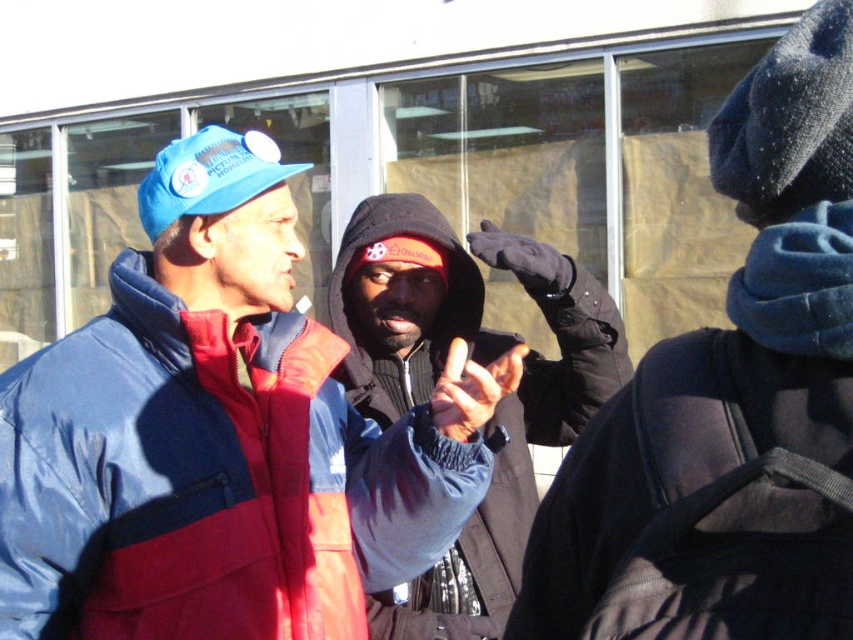
Can you confirm if blue fleece jacket at center is positioned below matte blue cap at upper left?

Indeed, blue fleece jacket at center is positioned under matte blue cap at upper left.

Between blue fleece jacket at center and matte blue cap at upper left, which one appears on the right side from the viewer's perspective?

→ Positioned to the right is blue fleece jacket at center.

Is point (39, 550) positioned after point (210, 180)?

No, it is in front of (210, 180).

You are a GUI agent. You are given a task and a screenshot of the screen. Output one action in this format:
    pyautogui.click(x=<x>, y=<y>)
    Task: Click on the blue fleece jacket at center
    The height and width of the screenshot is (640, 853).
    Given the screenshot: What is the action you would take?
    pyautogui.click(x=219, y=436)

Does black synthetic jacket at lower right appear over matte blue cap at upper left?

No.

Who is taller, black synthetic jacket at lower right or matte blue cap at upper left?

Standing taller between the two is black synthetic jacket at lower right.

Locate an element on the screen. black synthetic jacket at lower right is located at coordinates (701, 502).

Who is more forward, (186, 257) or (616, 467)?

Positioned in front is point (616, 467).

Does blue fleece jacket at center come behind dark blue jacket at center?

That is True.

At what (x,y) coordinates should I click in order to perform the action: click on blue fleece jacket at center. Please return your answer as a coordinate pair (x, y). The height and width of the screenshot is (640, 853). Looking at the image, I should click on (219, 436).